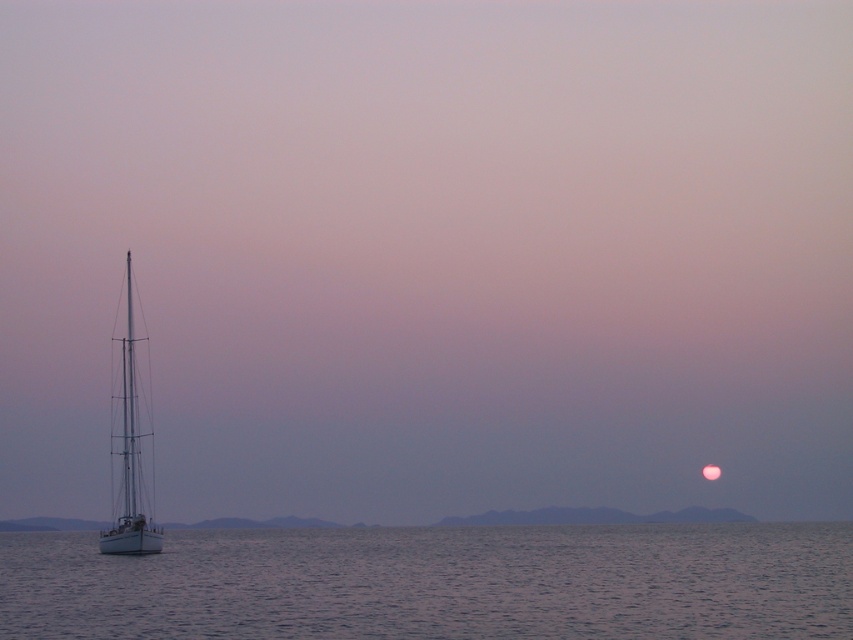
Question: Is clear water at lower left further to the viewer compared to white matte sailboat at left?

Choices:
 (A) yes
 (B) no

Answer: (B)

Question: Is clear water at lower left to the left of white matte sailboat at left from the viewer's perspective?

Choices:
 (A) yes
 (B) no

Answer: (B)

Question: Which point appears farthest from the camera in this image?

Choices:
 (A) 393,564
 (B) 128,518

Answer: (B)

Question: Which of the following is the closest to the observer?

Choices:
 (A) white matte sailboat at left
 (B) clear water at lower left

Answer: (B)

Question: Is clear water at lower left positioned before white matte sailboat at left?

Choices:
 (A) yes
 (B) no

Answer: (A)